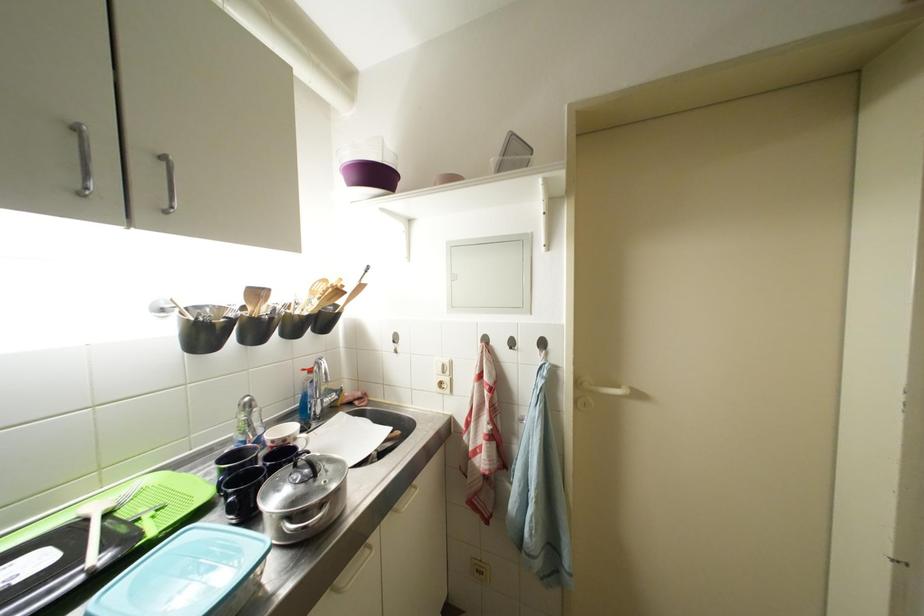
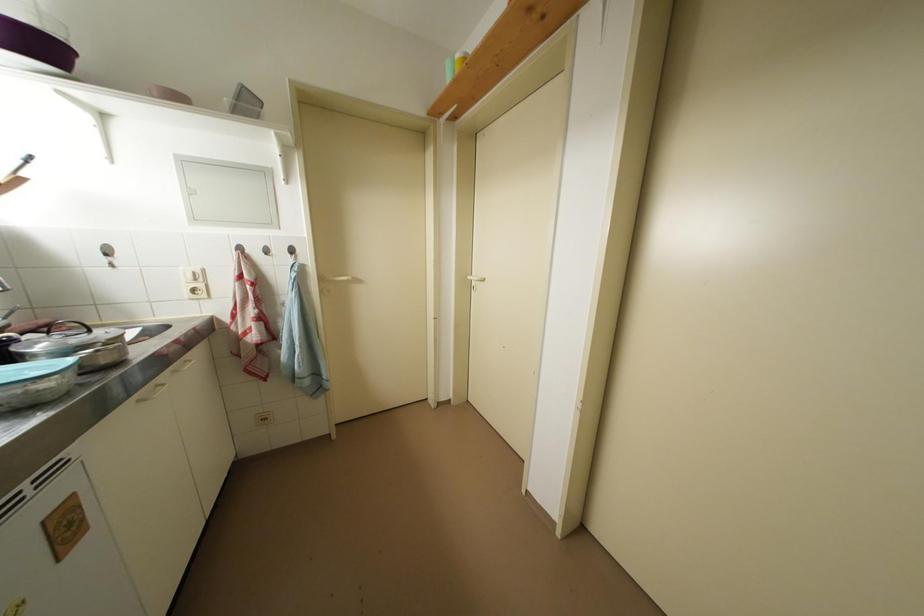
Find the pixel in the second image that matches (x=371, y=272) in the first image.

(30, 160)